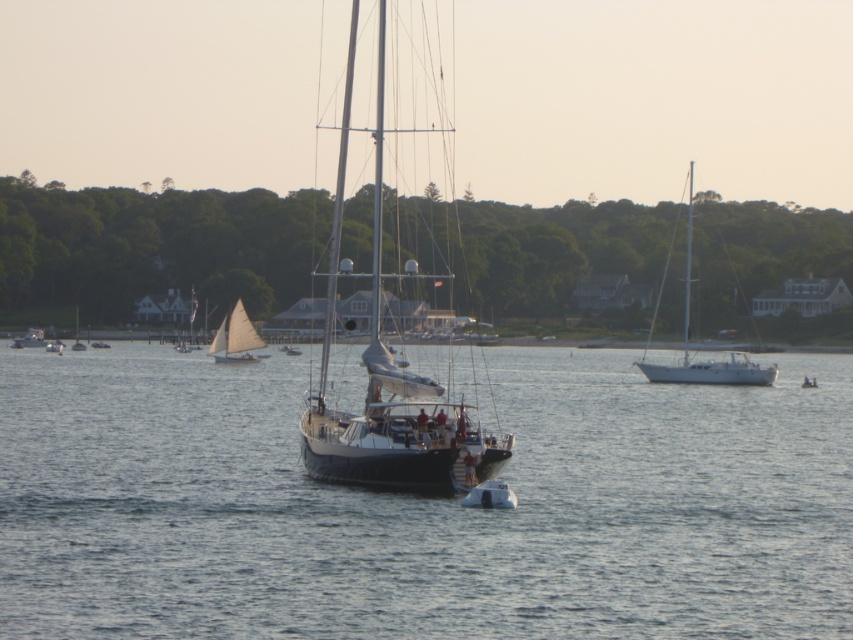
Does smooth water at center have a larger size compared to white glossy sailboat at right?

Actually, smooth water at center might be smaller than white glossy sailboat at right.

The image size is (853, 640). What are the coordinates of `smooth water at center` in the screenshot? It's located at (421, 506).

Does point (39, 339) come in front of point (85, 346)?

No, (39, 339) is further to viewer.

Is shiny white sailboat at center to the right of matte black sailboat at center from the viewer's perspective?

In fact, shiny white sailboat at center is to the left of matte black sailboat at center.

Is point (38, 339) behind point (71, 346)?

That is True.

Where is `shiny white sailboat at center`? This screenshot has height=640, width=853. shiny white sailboat at center is located at coordinates (28, 339).

Is point (223, 349) more distant than point (466, 493)?

Yes, point (223, 349) is behind point (466, 493).

Is the position of white sailboat at upper left more distant than that of white glossy dinghy at center?

Yes, white sailboat at upper left is behind white glossy dinghy at center.

Between point (221, 342) and point (490, 481), which one is positioned in front?

Positioned in front is point (490, 481).

You are a GUI agent. You are given a task and a screenshot of the screen. Output one action in this format:
    pyautogui.click(x=<x>, y=<y>)
    Task: Click on the white sailboat at upper left
    
    Given the screenshot: What is the action you would take?
    pyautogui.click(x=235, y=337)